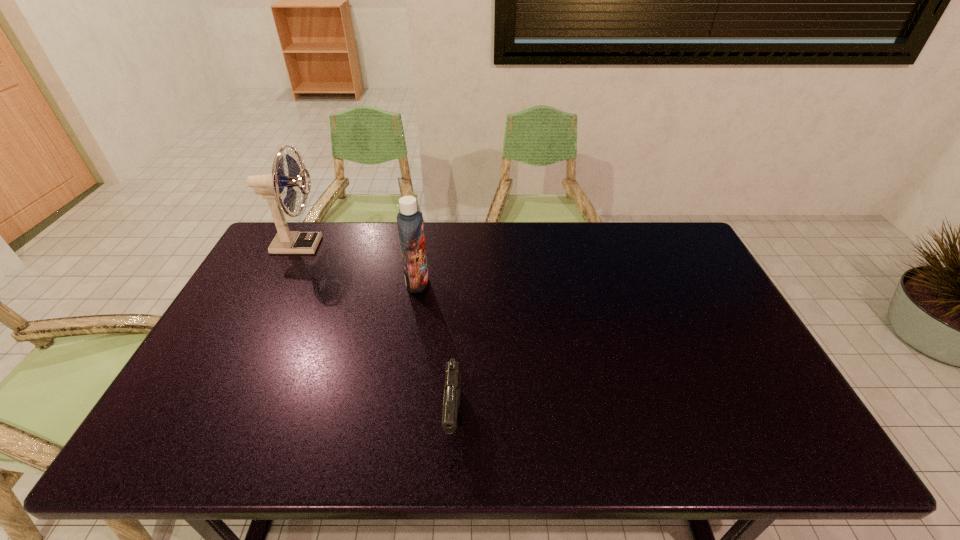
What are the coordinates of `vacant space that is in between the second object from left to right and the fan` in the screenshot? It's located at (358, 264).

The width and height of the screenshot is (960, 540). I want to click on vacant region between the shampoo and the pistol, so click(x=436, y=350).

Locate an element on the screen. Image resolution: width=960 pixels, height=540 pixels. free space between the second nearest object and the pistol is located at coordinates (436, 350).

Where is `empty space between the leftmost object and the second shortest object`? empty space between the leftmost object and the second shortest object is located at coordinates (358, 264).

Where is `free point between the nearest object and the fan`? This screenshot has height=540, width=960. free point between the nearest object and the fan is located at coordinates (376, 332).

The height and width of the screenshot is (540, 960). What are the coordinates of `vacant space that's between the fan and the shortest object` in the screenshot? It's located at (376, 332).

In order to click on free space that is in between the leftmost object and the nearest object in this screenshot , I will do `click(376, 332)`.

Identify the location of object that stands as the second closest to the leftmost object. This screenshot has height=540, width=960. coord(452,394).

Identify which object is located as the nearest to the second object from left to right. Please provide its 2D coordinates. Your answer should be formatted as a tuple, i.e. [(x, y)], where the tuple contains the x and y coordinates of a point satisfying the conditions above.

[(270, 186)]